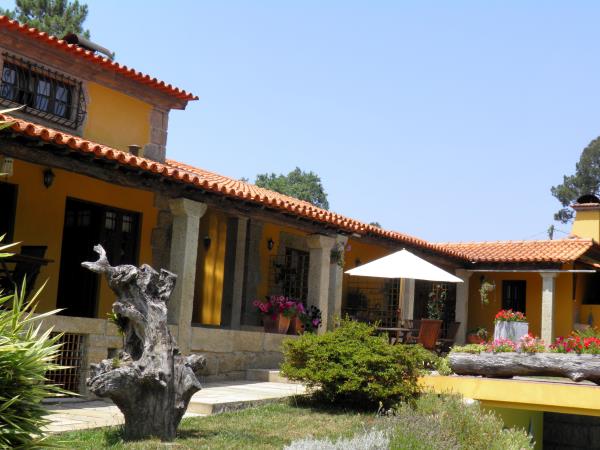
The height and width of the screenshot is (450, 600). I want to click on door, so click(78, 250).